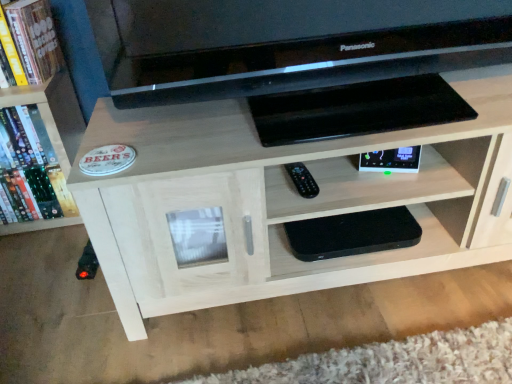
Where is `vacant region above light wood shelf at center, the 1th shelf viewed from the top (from a real-world perspective)`? This screenshot has width=512, height=384. vacant region above light wood shelf at center, the 1th shelf viewed from the top (from a real-world perspective) is located at coordinates (320, 112).